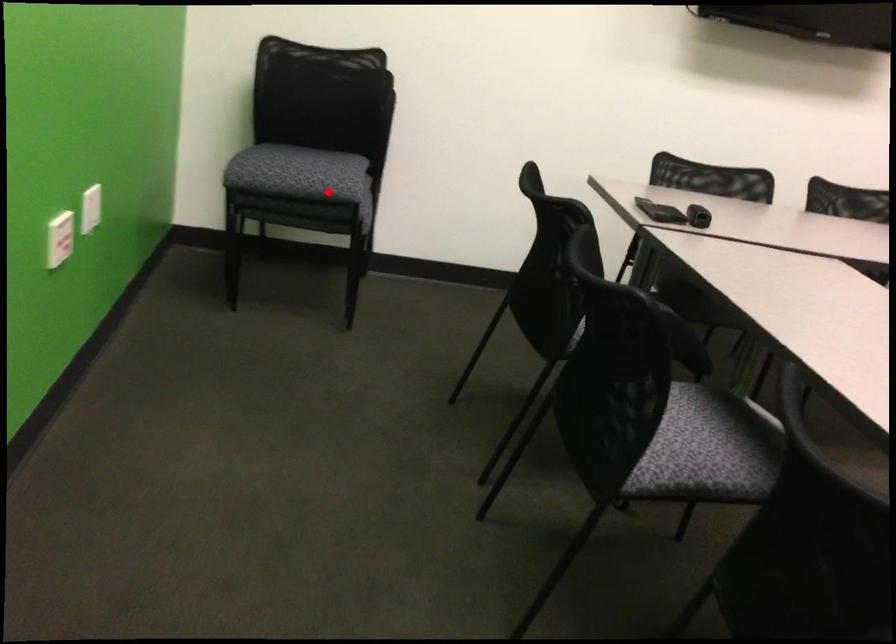
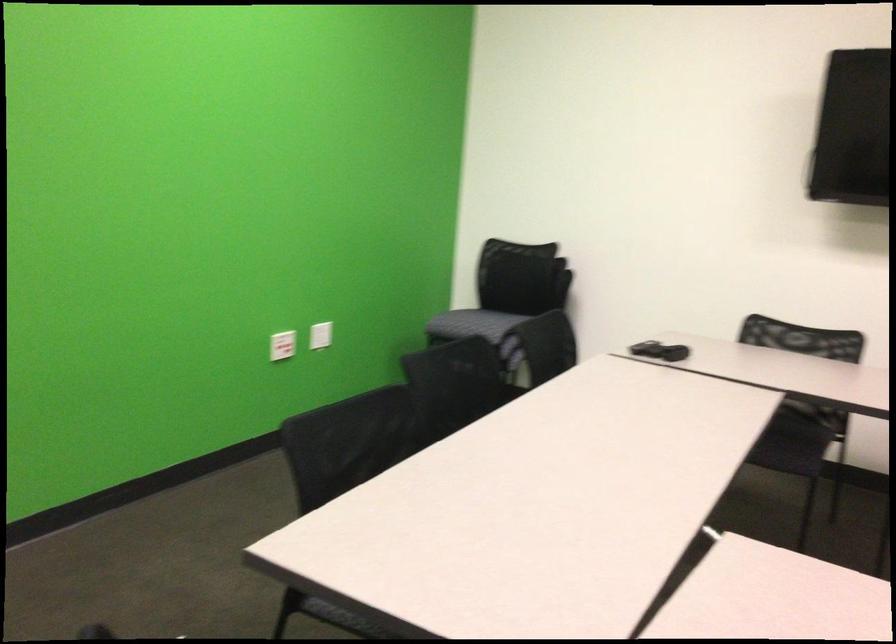
Question: A red point is marked in image1. In image2, is the corresponding 3D point closer to the camera or farther? Reply with the corresponding letter.

Choices:
 (A) The corresponding 3D point is closer.
 (B) The corresponding 3D point is farther.

Answer: (B)